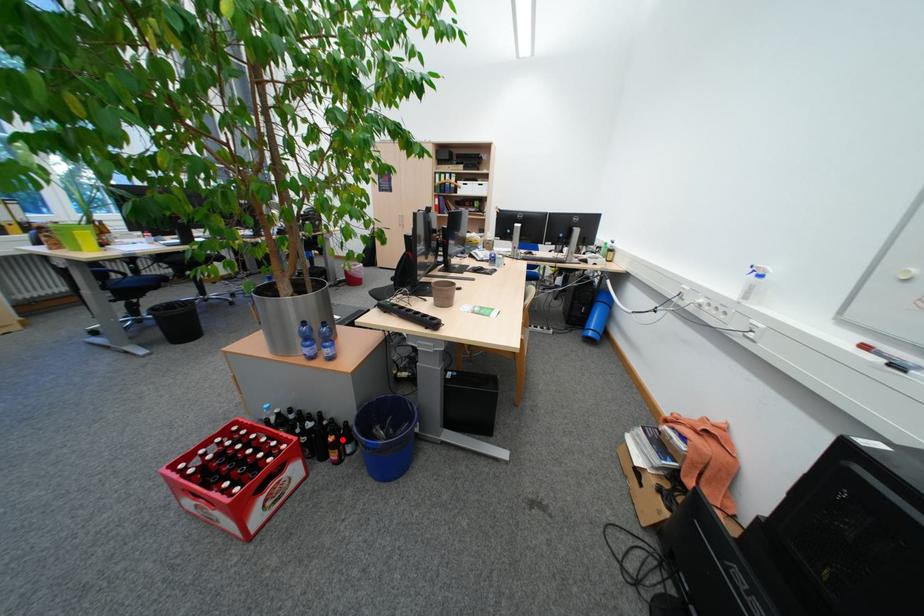
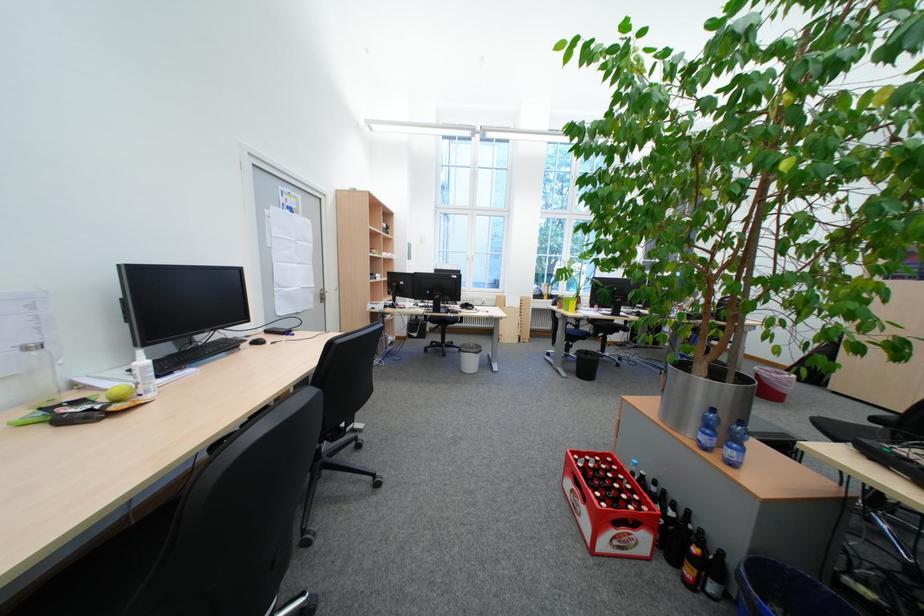
Find the pixel in the second image that matches the highlighted location in the first image.

(707, 551)